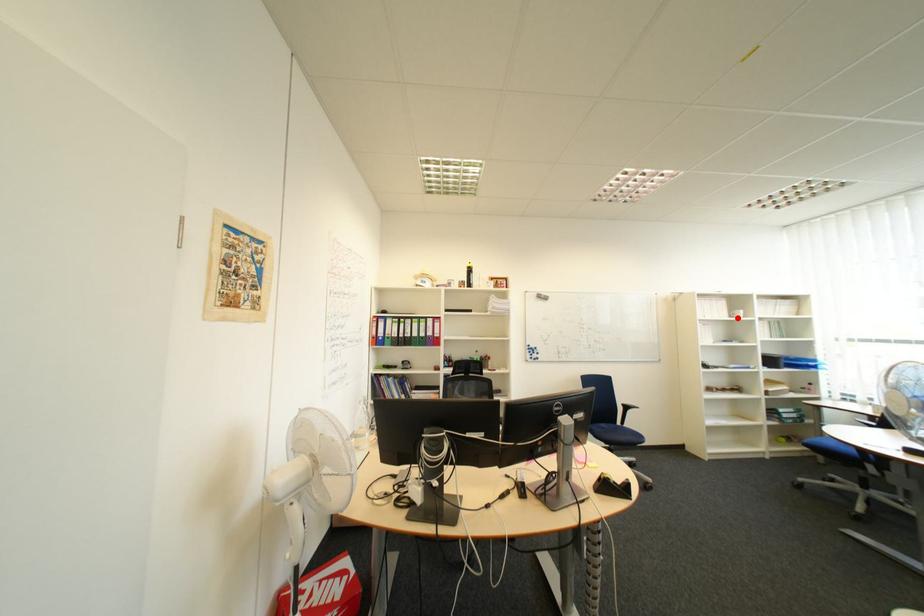
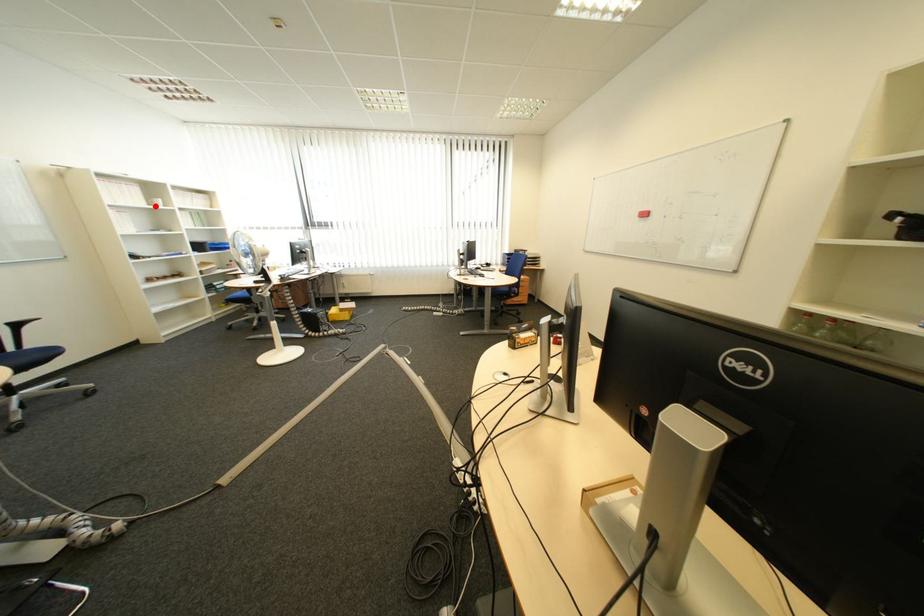
I am providing you with two images of the same scene from different viewpoints. A red point is marked on the first image and another point is marked on the second image. Are the points marked in image1 and image2 representing the same 3D position?

Yes